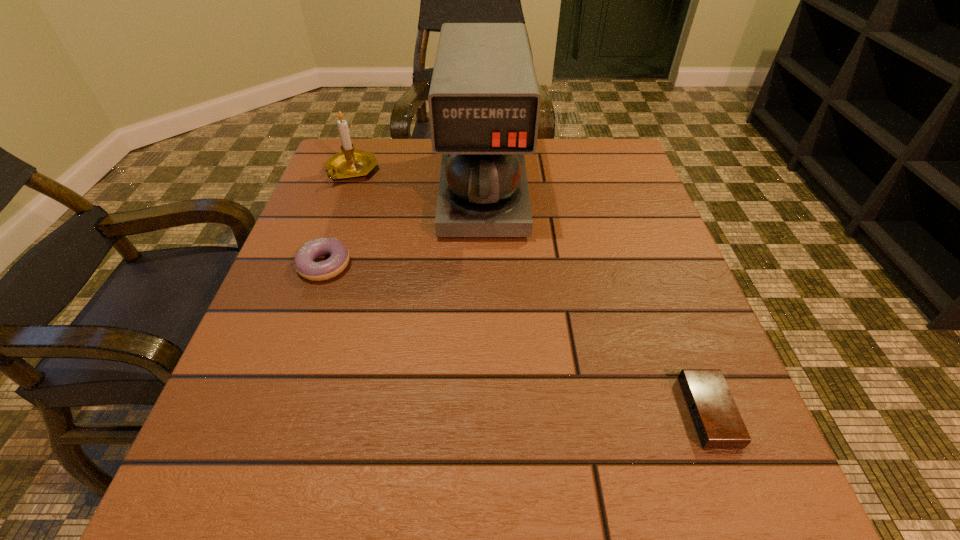
I want to click on vacant space located 0.220m on the front face of the shortest object, so click(x=536, y=412).

What are the coordinates of `free space located on the front face of the shortest object` in the screenshot? It's located at (493, 412).

Locate an element on the screen. The image size is (960, 540). free spot located on the front face of the shortest object is located at coordinates (508, 412).

Find the location of a particular element. This screenshot has width=960, height=540. coffee maker present at the far edge is located at coordinates (484, 101).

The width and height of the screenshot is (960, 540). In order to click on candle holder that is at the far edge in this screenshot , I will do `click(350, 163)`.

Locate an element on the screen. candle holder that is at the left edge is located at coordinates (350, 163).

This screenshot has width=960, height=540. I want to click on doughnut at the left edge, so click(x=304, y=264).

The height and width of the screenshot is (540, 960). In order to click on object that is at the right edge in this screenshot , I will do `click(715, 416)`.

Image resolution: width=960 pixels, height=540 pixels. I want to click on object that is at the far left corner, so click(350, 163).

Identify the location of vacant space at the near edge of the desktop. The image size is (960, 540). (604, 458).